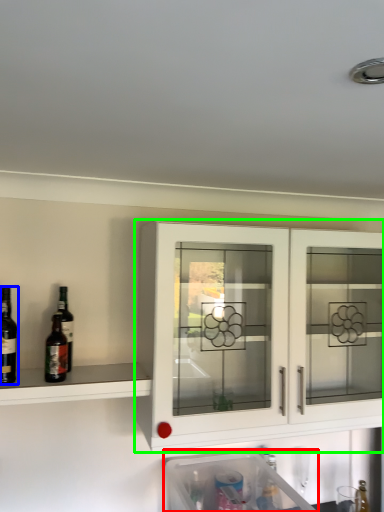
Question: Which object is the closest to the dish washer (highlighted by a red box)? Choose among these: wine (highlighted by a blue box) or cabinetry (highlighted by a green box).

Choices:
 (A) wine
 (B) cabinetry

Answer: (B)